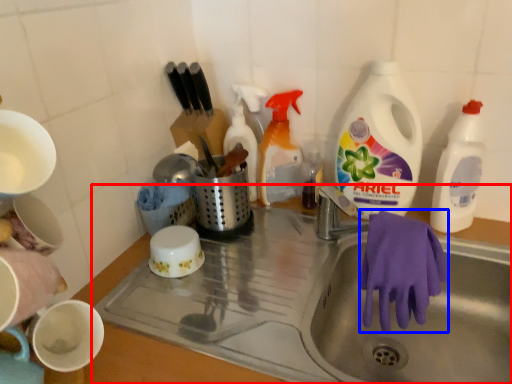
Question: Which object appears closest to the camera in this image, sink (highlighted by a red box) or glove (highlighted by a blue box)?

Choices:
 (A) sink
 (B) glove

Answer: (A)